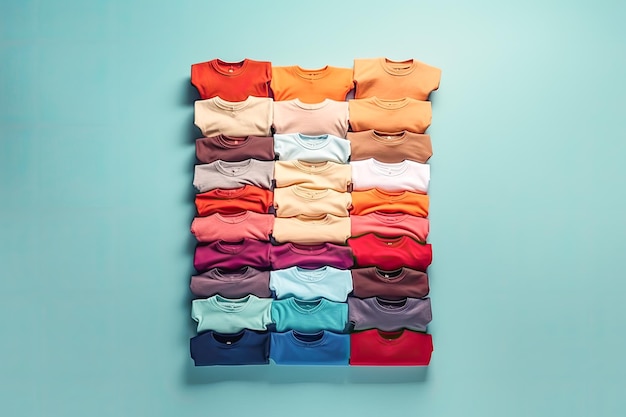
Identify the location of folded shirts in leftmost column. The image size is (626, 417). (242, 82), (242, 116), (242, 150), (242, 164), (240, 193), (240, 216), (244, 249), (244, 273), (242, 312), (242, 339).